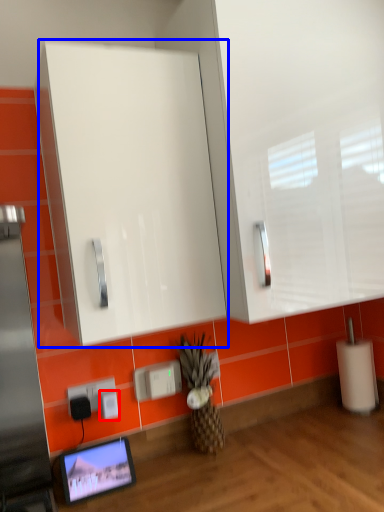
Question: Among these objects, which one is nearest to the camera, electric outlet (highlighted by a red box) or glass door (highlighted by a blue box)?

Choices:
 (A) electric outlet
 (B) glass door

Answer: (B)